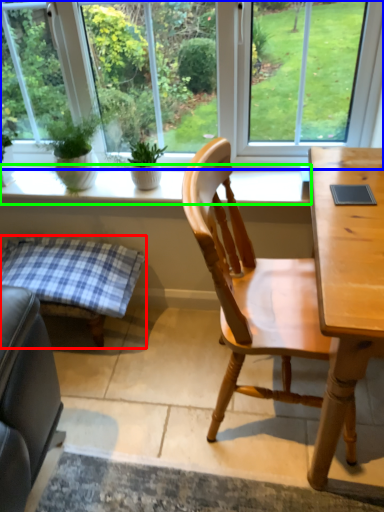
Question: Which object is the farthest from table (highlighted by a red box)? Choose among these: window (highlighted by a blue box) or window sill (highlighted by a green box).

Choices:
 (A) window
 (B) window sill

Answer: (A)